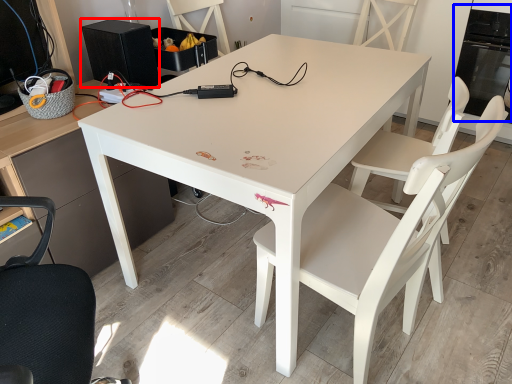
Question: Which object is closer to the camera taking this photo, appliance (highlighted by a red box) or oven (highlighted by a blue box)?

Choices:
 (A) appliance
 (B) oven

Answer: (A)